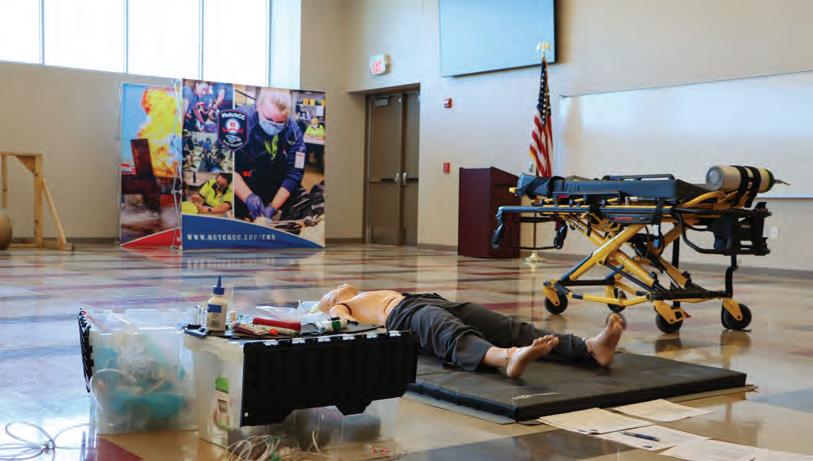
Where is `wall`? Image resolution: width=813 pixels, height=461 pixels. wall is located at coordinates pyautogui.click(x=629, y=57).